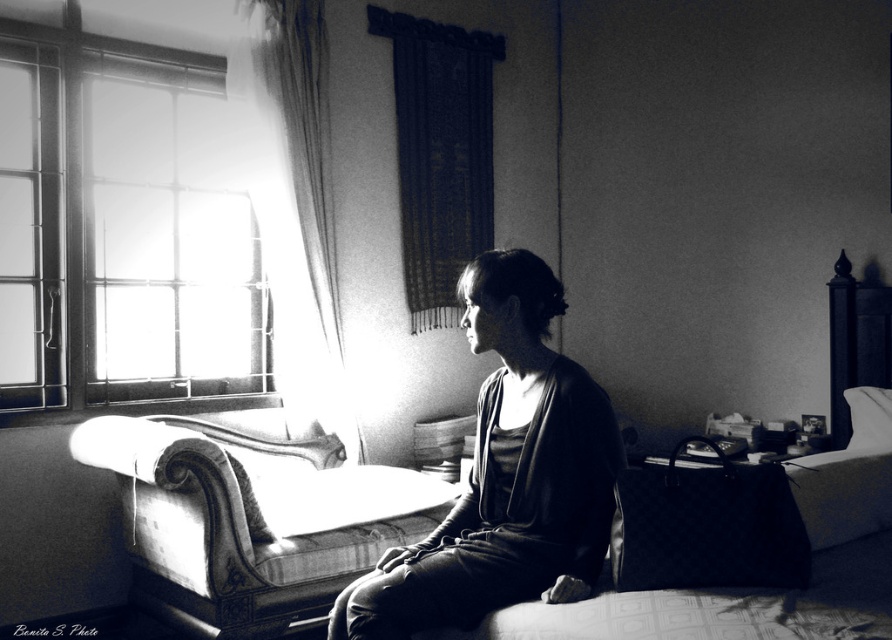
Which of these two, velvet-like fabric couch at center or soft fabric bed at center, stands shorter?

Standing shorter between the two is soft fabric bed at center.

Does point (292, 584) lie in front of point (785, 634)?

No.

Is point (230, 540) closer to viewer compared to point (889, 625)?

No, (230, 540) is further to viewer.

At what (x,y) coordinates should I click in order to perform the action: click on velvet-like fabric couch at center. Please return your answer as a coordinate pair (x, y). This screenshot has height=640, width=892. Looking at the image, I should click on (250, 522).

At what (x,y) coordinates should I click in order to perform the action: click on smooth fabric shirt at center. Please return your answer as a coordinate pair (x, y). The image size is (892, 640). Looking at the image, I should click on (505, 474).

Between point (556, 433) and point (288, 444), which one is positioned behind?

The point (288, 444) is more distant.

Identify the location of smooth fabric shirt at center. (505, 474).

Does point (0, 157) come closer to viewer compared to point (449, 564)?

No, (0, 157) is behind (449, 564).

Who is more forward, (60, 298) or (558, 545)?

Point (558, 545) is more forward.

Who is more distant from viewer, (139, 385) or (593, 536)?

Point (139, 385)

The width and height of the screenshot is (892, 640). In order to click on glass pane window at upper left in this screenshot , I will do `click(122, 224)`.